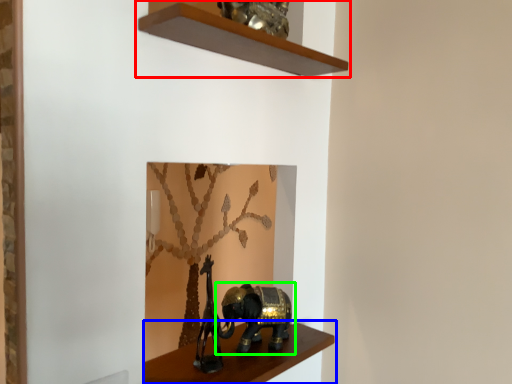
Question: Which object is the farthest from shelf (highlighted by a red box)? Choose among these: shelf (highlighted by a blue box) or elephant (highlighted by a green box).

Choices:
 (A) shelf
 (B) elephant

Answer: (A)